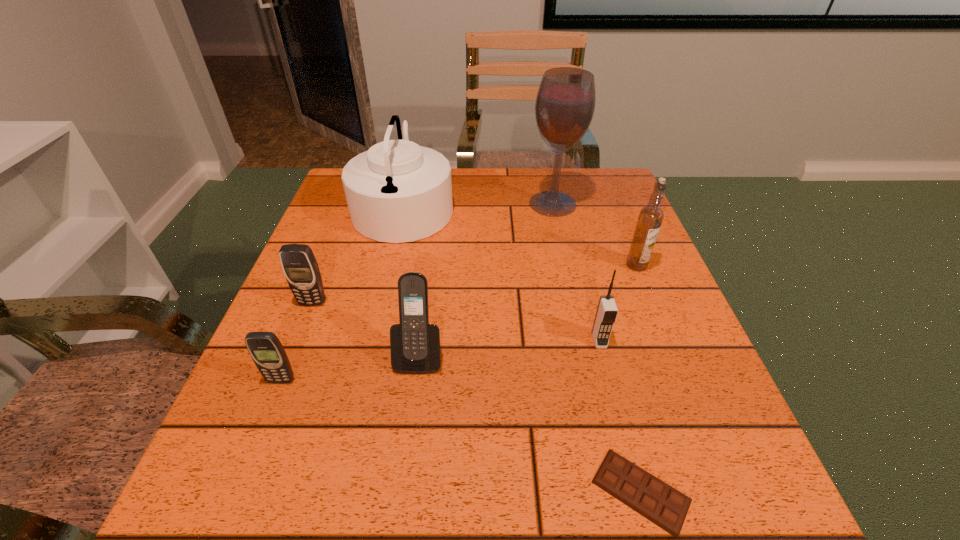
Identify the location of the shortest object. This screenshot has width=960, height=540. (657, 501).

Locate an element on the screen. vacant space positioned on the left of the alcohol is located at coordinates (475, 204).

Locate an element on the screen. The width and height of the screenshot is (960, 540). vacant space positioned 0.400m on the spout of the kettle is located at coordinates (605, 206).

Identify the location of free spot located 0.280m on the label of the sixth nearest object. The image size is (960, 540). (683, 379).

The width and height of the screenshot is (960, 540). I want to click on vacant space located 0.250m on the front-facing side of the third cellular telephone from left to right, so click(396, 531).

The image size is (960, 540). I want to click on vacant space situated on the front-facing side of the rightmost cellular telephone, so click(x=621, y=424).

Find the location of `vacant area located on the front face of the fifth nearest object`. vacant area located on the front face of the fifth nearest object is located at coordinates (297, 342).

Locate an element on the screen. vacant space located 0.240m on the screen of the second nearest object is located at coordinates (219, 539).

Identify the location of vacant area situated 0.250m on the left of the nearest object. (416, 491).

You are a GUI agent. You are given a task and a screenshot of the screen. Output one action in this format:
    pyautogui.click(x=<x>, y=<y>)
    Task: Click on the alcohol situated at the far edge
    This screenshot has height=540, width=960.
    Given the screenshot: What is the action you would take?
    pyautogui.click(x=565, y=103)